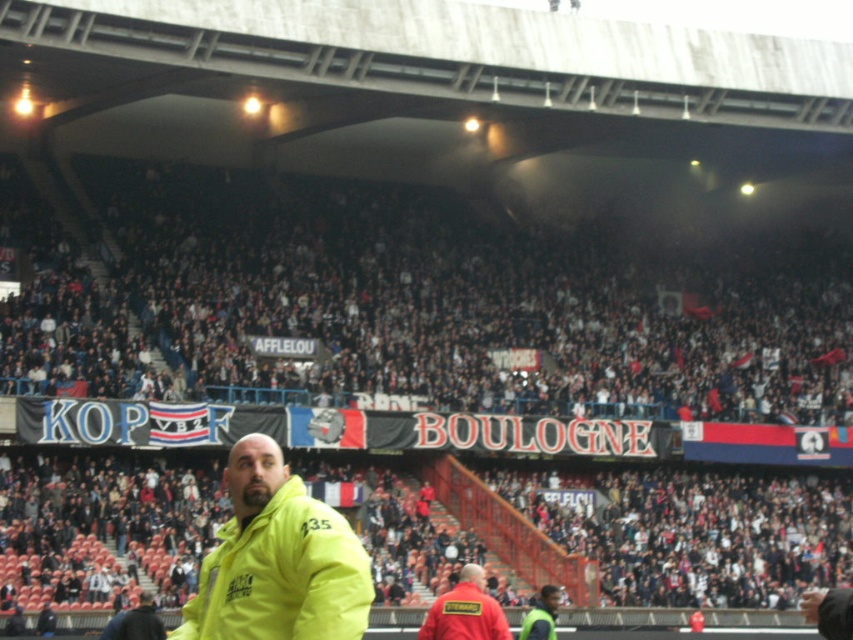
You are a photographer positioned at the edge of the field. You need to capture a photo that includes both the yellow matte jacket at center and the red fabric steward at lower center. Which object should you focus on first to ensure both are in frame?

The yellow matte jacket at center is taller than the red fabric steward at lower center. To ensure both are in frame, focus on the yellow matte jacket at center first as it occupies more vertical space, then adjust to include the smaller red fabric steward at lower center.